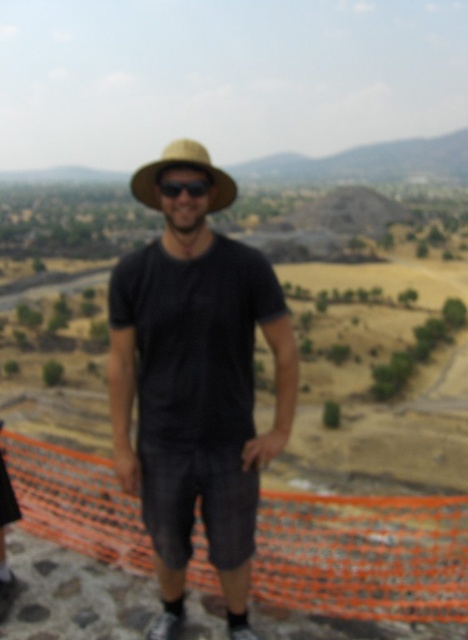
Does straw hat at center appear on the right side of black matte sunglasses at center?

Incorrect, straw hat at center is not on the right side of black matte sunglasses at center.

Can you confirm if straw hat at center is smaller than black matte sunglasses at center?

No.

Describe the element at coordinates (180, 168) in the screenshot. Image resolution: width=468 pixels, height=640 pixels. I see `straw hat at center` at that location.

Find the location of a particular element. The height and width of the screenshot is (640, 468). straw hat at center is located at coordinates click(180, 168).

Is matte black shirt at center taller than straw hat at center?

Incorrect, matte black shirt at center's height is not larger of straw hat at center's.

From the picture: Does matte black shirt at center appear on the right side of straw hat at center?

Indeed, matte black shirt at center is positioned on the right side of straw hat at center.

Describe the element at coordinates (196, 381) in the screenshot. I see `matte black shirt at center` at that location.

The height and width of the screenshot is (640, 468). Find the location of `matte black shirt at center`. matte black shirt at center is located at coordinates (196, 381).

Does matte black shirt at center have a smaller size compared to black matte sunglasses at center?

Incorrect, matte black shirt at center is not smaller in size than black matte sunglasses at center.

Between matte black shirt at center and black matte sunglasses at center, which one is positioned lower?

Positioned lower is matte black shirt at center.

Where is `matte black shirt at center`? matte black shirt at center is located at coordinates (196, 381).